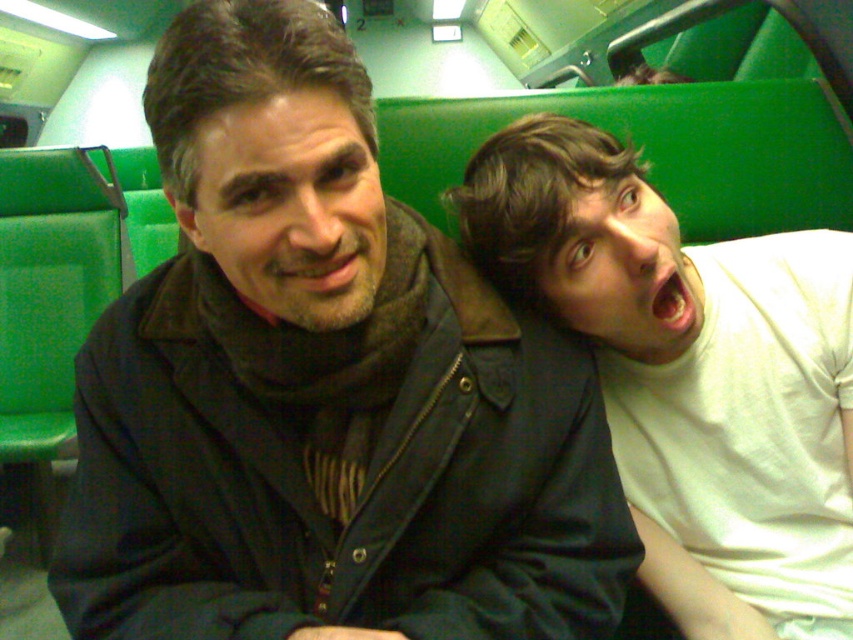
Consider the image. You are a photographer taking a group photo of two people sitting on a train seat. You need to ensure that both the dark blue jacket at center and the white matte shirt at right are clearly visible in the photo. Considering their sizes, which one might require more space in the frame?

The dark blue jacket at center is bigger than the white matte shirt at right, so it might require more space in the frame to ensure it is clearly visible.

You are a photographer trying to capture a candid shot of two people sitting on a train. You notice the dark blue jacket at center and the white matte shirt at right. Which clothing item would you focus on if you want to include more of the background in your photo?

The dark blue jacket at center is wider than the white matte shirt at right. To include more background, focus on the narrower object, so the white matte shirt at right should be the focus.